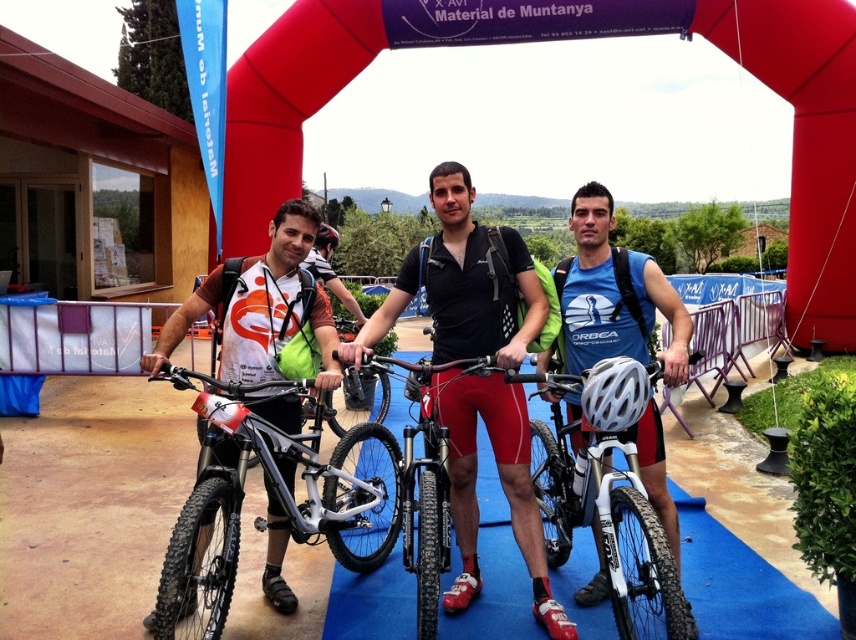
Which is behind, point (580, 196) or point (354, 570)?

Positioned behind is point (354, 570).

Between blue matte jersey at center and shiny metallic bicycle at center, which one has less height?

Standing shorter between the two is shiny metallic bicycle at center.

At what (x,y) coordinates should I click in order to perform the action: click on blue matte jersey at center. Please return your answer as a coordinate pair (x, y). This screenshot has width=856, height=640. Looking at the image, I should click on (613, 294).

Is matte black bicycle at center positioned at the back of silver metallic bicycle at center?

No, it is not.

Locate an element on the screen. The image size is (856, 640). matte black bicycle at center is located at coordinates (456, 284).

Find the location of a particular element. The image size is (856, 640). matte black bicycle at center is located at coordinates (456, 284).

Which is more to the left, matte black polo shirt at center or shiny metallic bicycle at center?

Positioned to the left is shiny metallic bicycle at center.

Can you confirm if matte black polo shirt at center is shorter than shiny metallic bicycle at center?

No.

At what (x,y) coordinates should I click in order to perform the action: click on matte black polo shirt at center. Please return your answer as a coordinate pair (x, y). The height and width of the screenshot is (640, 856). Looking at the image, I should click on (462, 284).